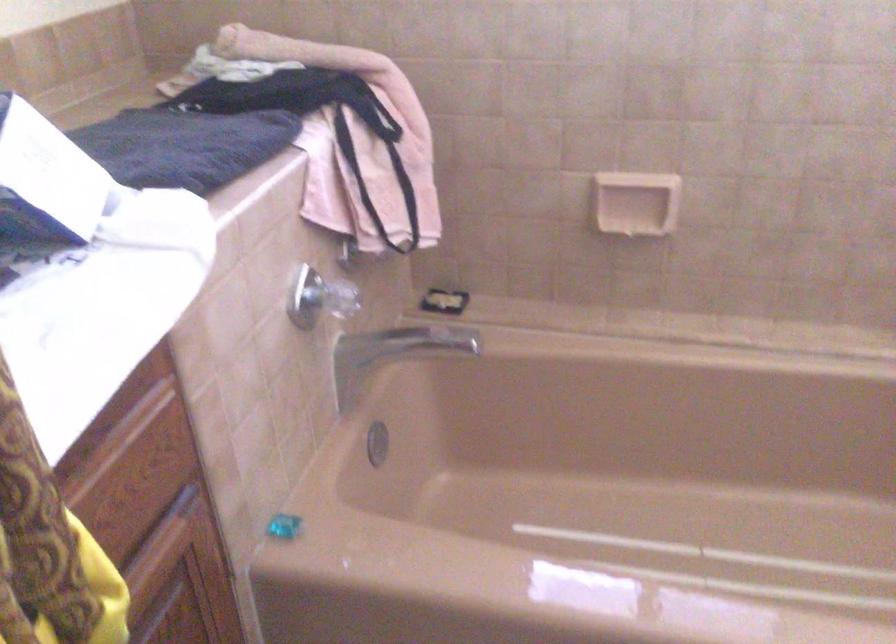
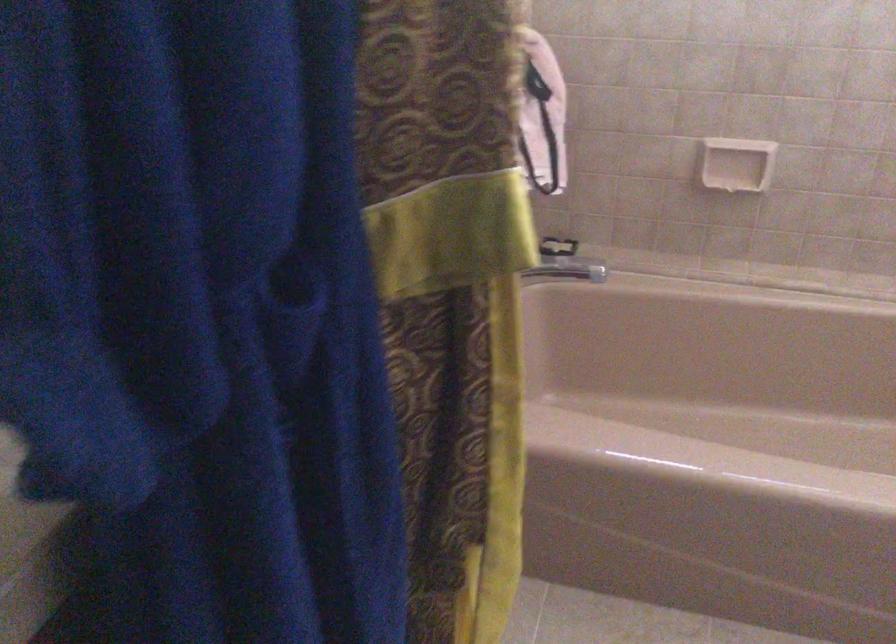
Where in the second image is the point corresponding to (x=394, y=162) from the first image?

(540, 116)